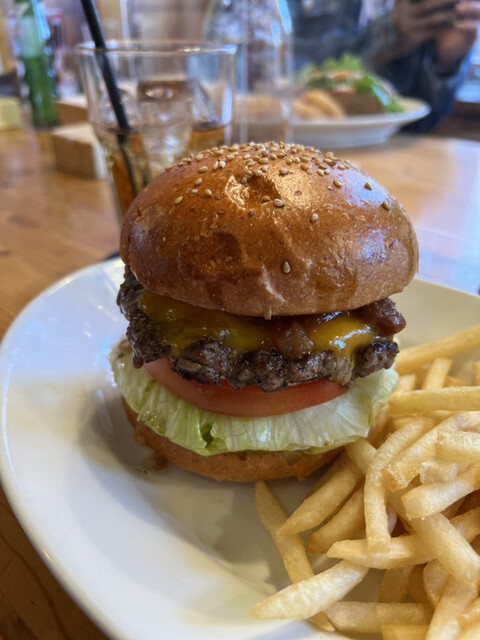
At what (x,y) coordinates should I click in order to perform the action: click on glass. Please return your answer as a coordinate pair (x, y). This screenshot has height=640, width=480. Looking at the image, I should click on (185, 104).